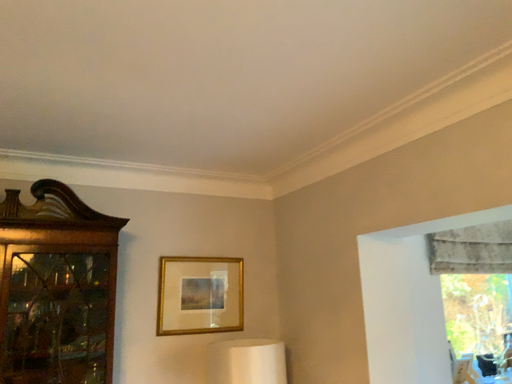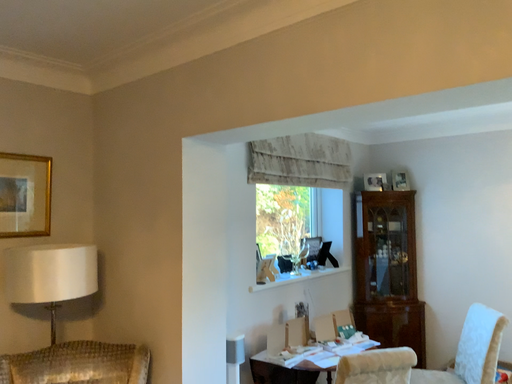
Question: How did the camera likely rotate when shooting the video?

Choices:
 (A) rotated left
 (B) rotated right

Answer: (B)